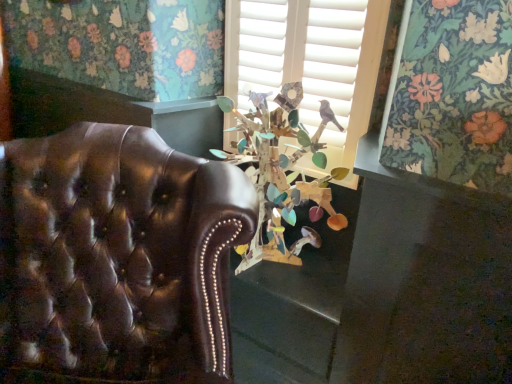
Question: Would you say shiny brown leather chair at left is part of wooden birdhouse at center's contents?

Choices:
 (A) yes
 (B) no

Answer: (B)

Question: Does wooden birdhouse at center have a larger size compared to shiny brown leather chair at left?

Choices:
 (A) yes
 (B) no

Answer: (B)

Question: Is wooden birdhouse at center to the right of shiny brown leather chair at left from the viewer's perspective?

Choices:
 (A) no
 (B) yes

Answer: (B)

Question: From a real-world perspective, is wooden birdhouse at center on shiny brown leather chair at left?

Choices:
 (A) no
 (B) yes

Answer: (B)

Question: From a real-world perspective, is wooden birdhouse at center physically below shiny brown leather chair at left?

Choices:
 (A) no
 (B) yes

Answer: (A)

Question: Is point (173, 321) closer or farther from the camera than point (275, 119)?

Choices:
 (A) closer
 (B) farther

Answer: (A)

Question: From a real-world perspective, is shiny brown leather chair at left above or below wooden birdhouse at center?

Choices:
 (A) below
 (B) above

Answer: (A)

Question: Is shiny brown leather chair at left taller or shorter than wooden birdhouse at center?

Choices:
 (A) short
 (B) tall

Answer: (B)

Question: Considering the positions of shiny brown leather chair at left and wooden birdhouse at center in the image, is shiny brown leather chair at left bigger or smaller than wooden birdhouse at center?

Choices:
 (A) big
 (B) small

Answer: (A)

Question: In the image, is wooden birdhouse at center on the left side or the right side of shiny brown leather chair at left?

Choices:
 (A) right
 (B) left

Answer: (A)

Question: From their relative heights in the image, would you say wooden birdhouse at center is taller or shorter than shiny brown leather chair at left?

Choices:
 (A) tall
 (B) short

Answer: (B)

Question: In terms of size, does wooden birdhouse at center appear bigger or smaller than shiny brown leather chair at left?

Choices:
 (A) big
 (B) small

Answer: (B)

Question: From the image's perspective, is wooden birdhouse at center positioned above or below shiny brown leather chair at left?

Choices:
 (A) above
 (B) below

Answer: (A)

Question: Based on their sizes in the image, would you say wooden birdhouse at center is bigger or smaller than shiny brown leather chair at left?

Choices:
 (A) big
 (B) small

Answer: (B)

Question: Is wooden birdhouse at center wider or thinner than shiny brown leather chair at left?

Choices:
 (A) thin
 (B) wide

Answer: (A)